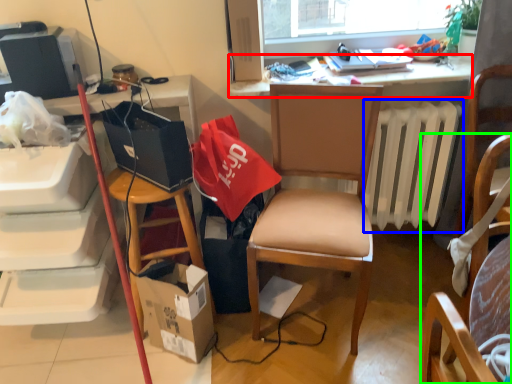
Question: Considering the real-world distances, which object is farthest from desk (highlighted by a red box)? radiator (highlighted by a blue box) or chair (highlighted by a green box)?

Choices:
 (A) radiator
 (B) chair

Answer: (B)